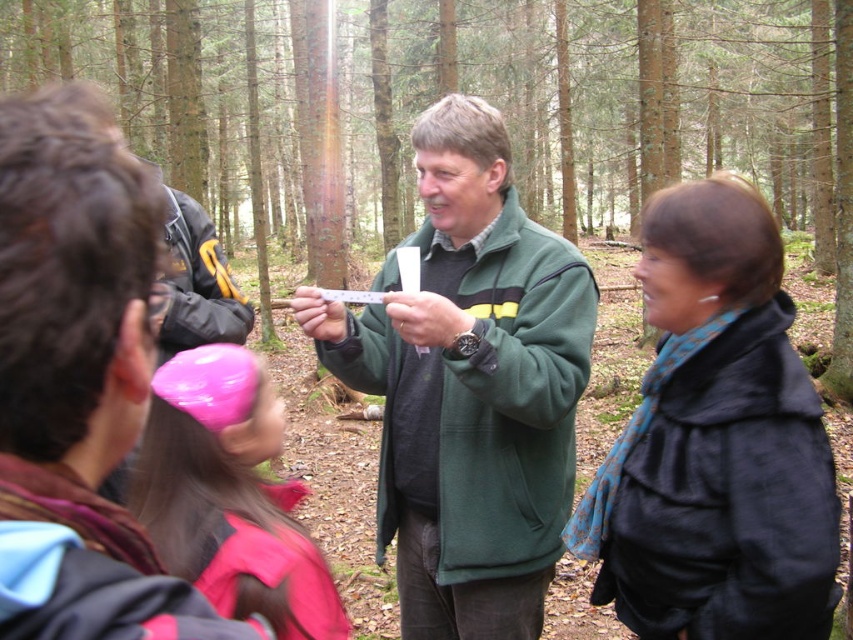
Based on the photo, can you confirm if green matte sweater at center is smaller than pink plastic magnifying glass at upper left?

No, green matte sweater at center is not smaller than pink plastic magnifying glass at upper left.

Is point (201, 200) positioned behind point (67, 344)?

Yes, point (201, 200) is behind point (67, 344).

Is point (190, 132) positioned before point (115, 420)?

That is False.

Find the location of a particular element. This screenshot has width=853, height=640. green matte sweater at center is located at coordinates (480, 97).

Between black matte coat at center and pink plastic magnifying glass at center, which one is positioned higher?

black matte coat at center

Who is lower down, black matte coat at center or pink plastic magnifying glass at center?

pink plastic magnifying glass at center is lower down.

Where is `black matte coat at center`? The width and height of the screenshot is (853, 640). black matte coat at center is located at coordinates (715, 442).

Locate an element on the screen. This screenshot has height=640, width=853. black matte coat at center is located at coordinates (715, 442).

The width and height of the screenshot is (853, 640). In order to click on pink plastic magnifying glass at upper left in this screenshot , I will do `click(78, 378)`.

Is point (132, 252) positioned behind point (215, 540)?

No, (132, 252) is in front of (215, 540).

Locate an element on the screen. pink plastic magnifying glass at upper left is located at coordinates (78, 378).